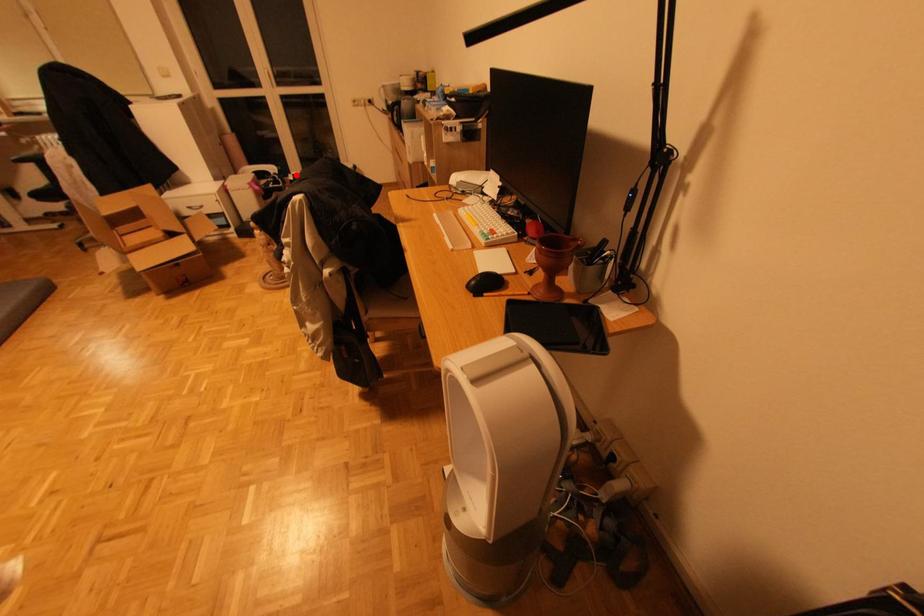
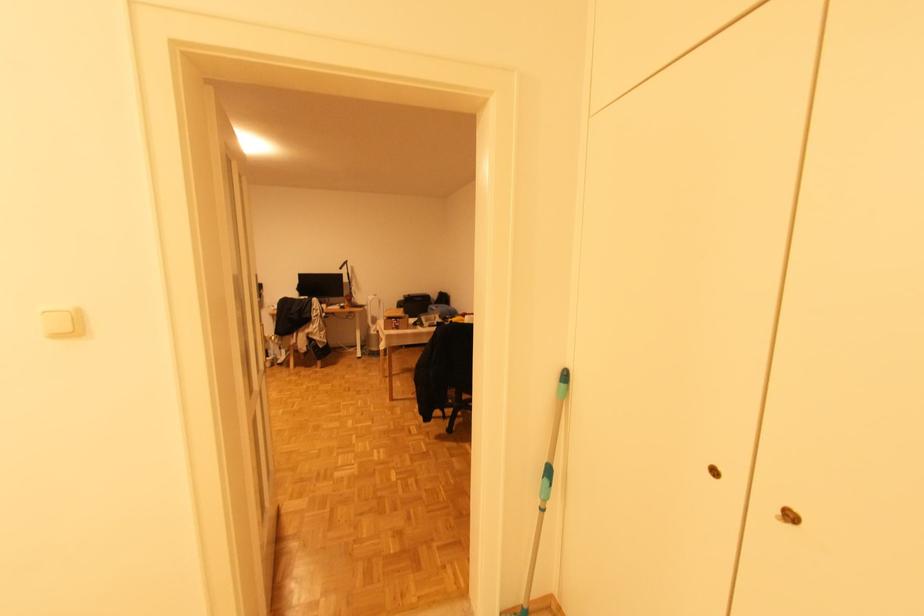
Question: I am providing you with two images of the same scene from different viewpoints. A red point is marked on the first image. Can you still see the location of the red point in image 2?

Choices:
 (A) Yes
 (B) No

Answer: (B)